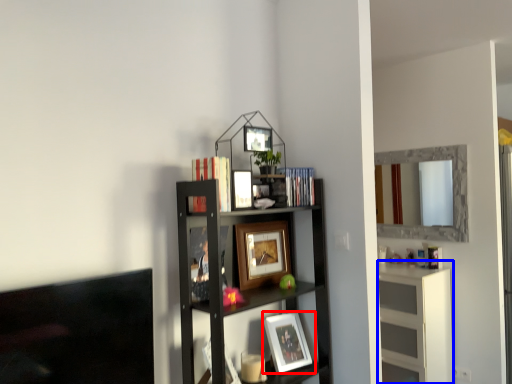
Question: Which object is closer to the camera taking this photo, picture frame (highlighted by a red box) or cabinet (highlighted by a blue box)?

Choices:
 (A) picture frame
 (B) cabinet

Answer: (A)